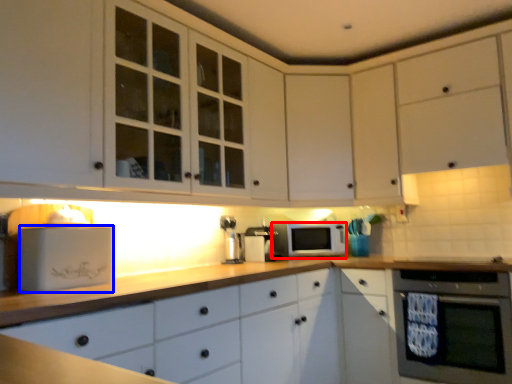
Question: Which point is further to the camera, microwave oven (highlighted by a red box) or appliance (highlighted by a blue box)?

Choices:
 (A) microwave oven
 (B) appliance

Answer: (A)